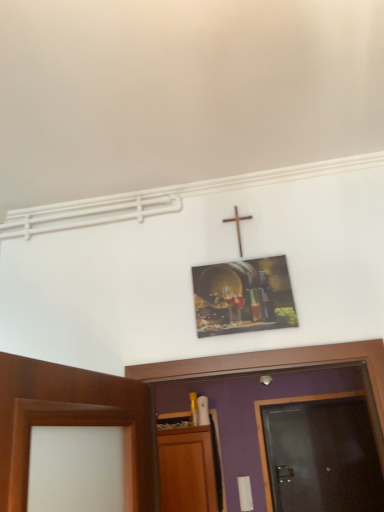
Locate an element on the screen. This screenshot has width=384, height=512. wooden cross at upper center is located at coordinates (238, 226).

At what (x,y) coordinates should I click in order to perform the action: click on dark wood door at right. Please return your answer as a coordinate pair (x, y). Looking at the image, I should click on (322, 456).

Image resolution: width=384 pixels, height=512 pixels. Find the location of `wooden cross at upper center`. wooden cross at upper center is located at coordinates (238, 226).

From the image's perspective, which one is positioned lower, metallic wine barrel at upper center or wooden cross at upper center?

From the image's view, metallic wine barrel at upper center is below.

Is there a large distance between metallic wine barrel at upper center and wooden cross at upper center?

metallic wine barrel at upper center is near wooden cross at upper center, not far away.

Is metallic wine barrel at upper center further to the viewer compared to wooden cross at upper center?

No, the depth of metallic wine barrel at upper center is less than that of wooden cross at upper center.

Does metallic wine barrel at upper center have a greater width compared to wooden cross at upper center?

Correct, the width of metallic wine barrel at upper center exceeds that of wooden cross at upper center.

Based on the photo, is dark wood door at right behind wooden cross at upper center?

Yes, dark wood door at right is further from the camera.

Considering the sizes of objects dark wood door at right and wooden cross at upper center in the image provided, who is bigger, dark wood door at right or wooden cross at upper center?

Bigger between the two is dark wood door at right.

Do you think dark wood door at right is within wooden cross at upper center, or outside of it?

dark wood door at right cannot be found inside wooden cross at upper center.

Can you confirm if dark wood door at right is shorter than wooden cross at upper center?

Incorrect, the height of dark wood door at right does not fall short of that of wooden cross at upper center.

Which of these two, wooden cross at upper center or dark wood door at right, is thinner?

wooden cross at upper center.

Considering the points (251, 218) and (322, 460), which point is behind, point (251, 218) or point (322, 460)?

Point (322, 460)

How many degrees apart are the facing directions of wooden cross at upper center and dark wood door at right?

The angle between the facing direction of wooden cross at upper center and the facing direction of dark wood door at right is 2.05 degrees.

Is wooden cross at upper center not near dark wood door at right?

Absolutely, wooden cross at upper center is distant from dark wood door at right.

Is dark wood door at right inside the boundaries of metallic wine barrel at upper center, or outside?

dark wood door at right lies outside metallic wine barrel at upper center.

Consider the image. Is the position of dark wood door at right less distant than that of metallic wine barrel at upper center?

No, dark wood door at right is further to the viewer.

Which is closer to the camera, (340, 449) or (273, 272)?

Point (340, 449) is farther from the camera than point (273, 272).

From the picture: Is wooden cross at upper center further to the viewer compared to metallic wine barrel at upper center?

Yes, it is.

Can you confirm if wooden cross at upper center is shorter than metallic wine barrel at upper center?

Yes, wooden cross at upper center is shorter than metallic wine barrel at upper center.

Considering the positions of objects wooden cross at upper center and metallic wine barrel at upper center in the image provided, who is more to the right, wooden cross at upper center or metallic wine barrel at upper center?

metallic wine barrel at upper center is more to the right.

Is wooden cross at upper center aimed at metallic wine barrel at upper center?

No.

Does point (254, 280) come farther from viewer compared to point (354, 502)?

That is False.

Is metallic wine barrel at upper center turned away from dark wood door at right?

Yes, metallic wine barrel at upper center's orientation is away from dark wood door at right.

Based on the photo, is metallic wine barrel at upper center in front of or behind dark wood door at right in the image?

Clearly, metallic wine barrel at upper center is in front of dark wood door at right.

I want to click on door to the right of metallic wine barrel at upper center, so click(x=322, y=456).

In the image, there is a wooden cross at upper center. Identify the location of picture frame below it (from a real-world perspective). (243, 296).

You are a GUI agent. You are given a task and a screenshot of the screen. Output one action in this format:
    pyautogui.click(x=<x>, y=<y>)
    Task: Click on the crucifix above the dark wood door at right (from a real-world perspective)
    The width and height of the screenshot is (384, 512).
    Given the screenshot: What is the action you would take?
    pyautogui.click(x=238, y=226)

Estimate the real-world distances between objects in this image. Which object is further from dark wood door at right, wooden cross at upper center or metallic wine barrel at upper center?

wooden cross at upper center is positioned further to the anchor dark wood door at right.

From the image, which object appears to be nearer to metallic wine barrel at upper center, dark wood door at right or wooden cross at upper center?

wooden cross at upper center.

When comparing their distances from dark wood door at right, does metallic wine barrel at upper center or wooden cross at upper center seem closer?

metallic wine barrel at upper center is closer to dark wood door at right.

Estimate the real-world distances between objects in this image. Which object is closer to metallic wine barrel at upper center, wooden cross at upper center or dark wood door at right?

wooden cross at upper center.

Considering their positions, is metallic wine barrel at upper center positioned closer to wooden cross at upper center than dark wood door at right?

metallic wine barrel at upper center lies closer to wooden cross at upper center than the other object.

Looking at this image, looking at the image, which one is located closer to wooden cross at upper center, dark wood door at right or metallic wine barrel at upper center?

metallic wine barrel at upper center is closer to wooden cross at upper center.

Find the location of a particular element. This screenshot has height=512, width=384. picture frame between wooden cross at upper center and dark wood door at right in the vertical direction is located at coordinates (243, 296).